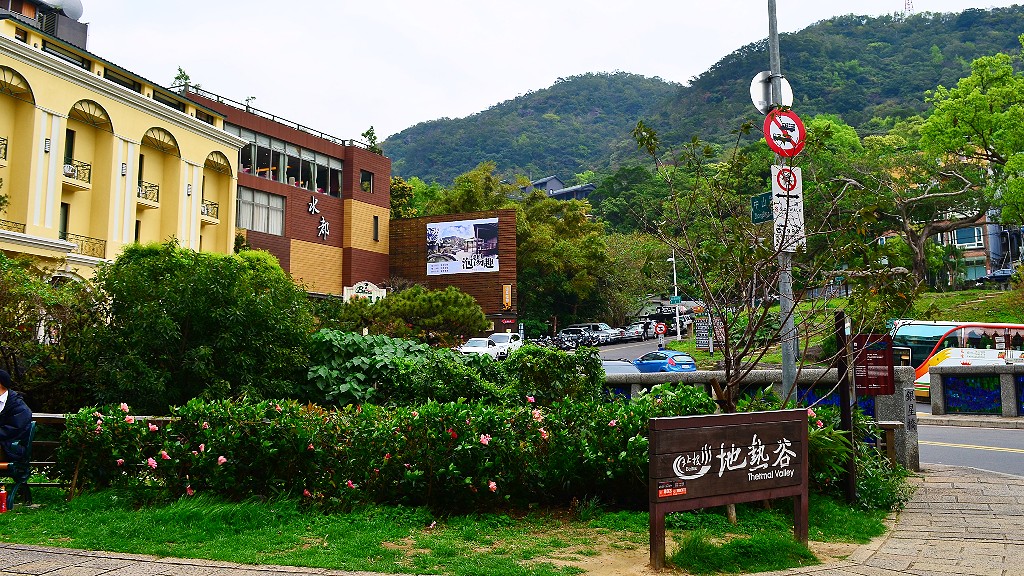
Where is `bench`? This screenshot has width=1024, height=576. bench is located at coordinates (28, 441).